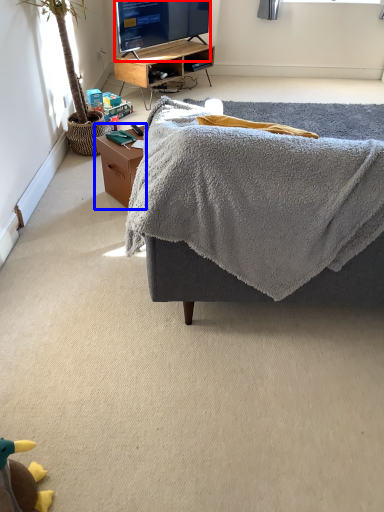
Question: Which point is further to the camera, television (highlighted by a red box) or table (highlighted by a blue box)?

Choices:
 (A) television
 (B) table

Answer: (A)